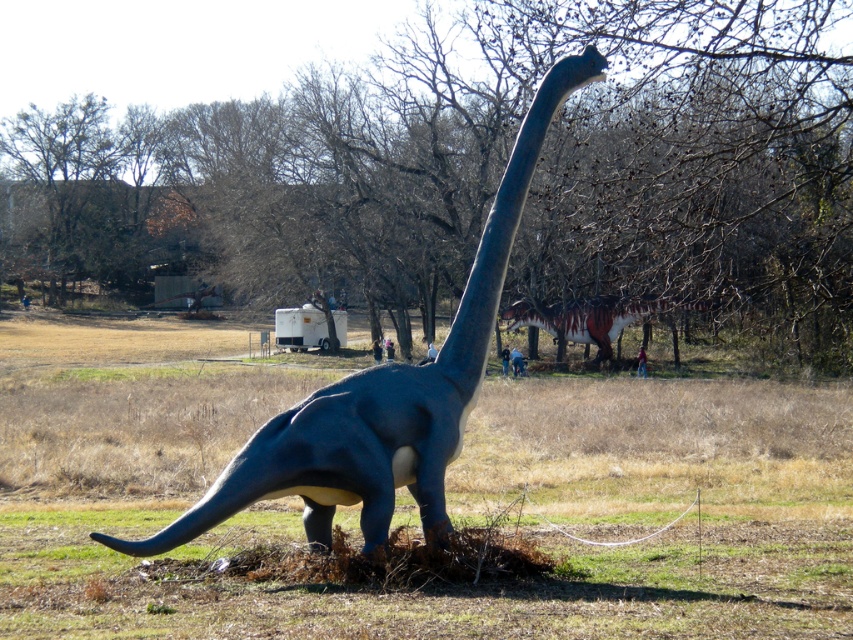
Which is below, green grass at lower center or shiny blue dinosaur at center?

Positioned lower is green grass at lower center.

Is the position of green grass at lower center less distant than that of shiny blue dinosaur at center?

Yes, green grass at lower center is in front of shiny blue dinosaur at center.

Who is more forward, (724, 588) or (442, 528)?

Point (724, 588)

Locate an element on the screen. Image resolution: width=853 pixels, height=640 pixels. green grass at lower center is located at coordinates (444, 588).

Between green grass at lower center and shiny metallic dinosaur at center, which one appears on the left side from the viewer's perspective?

green grass at lower center is more to the left.

Between point (527, 602) and point (587, 337), which one is positioned behind?

Positioned behind is point (587, 337).

Find the location of a particular element. The image size is (853, 640). green grass at lower center is located at coordinates pyautogui.click(x=444, y=588).

Identify the location of green grass at lower center. The image size is (853, 640). (444, 588).

Can you confirm if shiny blue dinosaur at center is taller than shiny metallic dinosaur at center?

Indeed, shiny blue dinosaur at center has a greater height compared to shiny metallic dinosaur at center.

Which is above, shiny blue dinosaur at center or shiny metallic dinosaur at center?

shiny metallic dinosaur at center is above.

Is point (410, 417) closer to viewer compared to point (602, 310)?

That is True.

Locate an element on the screen. The width and height of the screenshot is (853, 640). shiny blue dinosaur at center is located at coordinates [x=386, y=394].